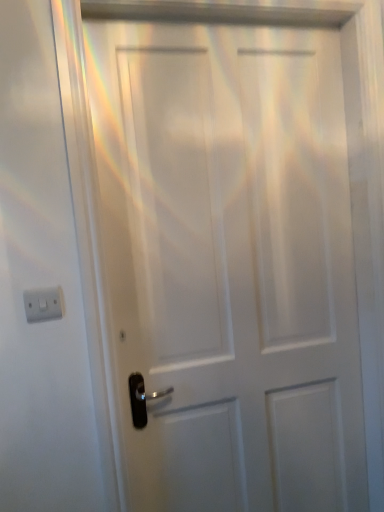
What do you see at coordinates (230, 264) in the screenshot? I see `white matte door at center` at bounding box center [230, 264].

In order to face white matte door at center, should I rotate leftwards or rightwards?

Rotate your view right by about 7.378°.

Measure the distance between point (292, 67) and camera.

Point (292, 67) is 4.41 feet from camera.

Locate an element on the screen. Image resolution: width=384 pixels, height=512 pixels. white matte door at center is located at coordinates (230, 264).

Where is `white plastic light switch at left`? The height and width of the screenshot is (512, 384). white plastic light switch at left is located at coordinates (43, 304).

Describe the element at coordinates (43, 304) in the screenshot. The width and height of the screenshot is (384, 512). I see `white plastic light switch at left` at that location.

In order to click on white matte door at center in this screenshot , I will do `click(230, 264)`.

Visually, is white matte door at center positioned to the left or to the right of white plastic light switch at left?

white matte door at center is to the right of white plastic light switch at left.

Is white matte door at center in front of white plastic light switch at left?

No, white matte door at center is further to the viewer.

Which is in front, point (135, 94) or point (48, 297)?

Positioned in front is point (48, 297).

From the image's perspective, would you say white matte door at center is shown under white plastic light switch at left?

Yes, from the image's perspective, white matte door at center is below white plastic light switch at left.

Based on the photo, from a real-world perspective, is white matte door at center over white plastic light switch at left?

No, from a real-world perspective, white matte door at center is not over white plastic light switch at left

Is white matte door at center wider than white plastic light switch at left?

Correct, the width of white matte door at center exceeds that of white plastic light switch at left.

Between white matte door at center and white plastic light switch at left, which one has more height?

white matte door at center.

Based on their sizes in the image, would you say white matte door at center is bigger or smaller than white plastic light switch at left?

Considering their sizes, white matte door at center takes up more space than white plastic light switch at left.

Is white matte door at center positioned beyond the bounds of white plastic light switch at left?

Absolutely, white matte door at center is external to white plastic light switch at left.

Is white matte door at center positioned far away from white plastic light switch at left?

They are positioned close to each other.

Is white matte door at center oriented towards white plastic light switch at left?

No, white matte door at center is not oriented towards white plastic light switch at left.

How distant is white matte door at center from white plastic light switch at left?

26.22 inches.

Image resolution: width=384 pixels, height=512 pixels. I want to click on door below the white plastic light switch at left (from a real-world perspective), so click(x=230, y=264).

Is white plastic light switch at left at the left side of white matte door at center?

Yes.

Does white plastic light switch at left lie behind white matte door at center?

That is False.

Which is behind, point (49, 298) or point (168, 161)?

The point (168, 161) is farther.

From the image's perspective, who appears lower, white plastic light switch at left or white matte door at center?

white matte door at center, from the image's perspective.

From a real-world perspective, does white plastic light switch at left sit lower than white matte door at center?

Incorrect, from a real-world perspective, white plastic light switch at left is higher than white matte door at center.

Considering the relative sizes of white plastic light switch at left and white matte door at center in the image provided, is white plastic light switch at left thinner than white matte door at center?

Yes.

Considering the sizes of objects white plastic light switch at left and white matte door at center in the image provided, who is taller, white plastic light switch at left or white matte door at center?

With more height is white matte door at center.

Consider the image. Looking at the image, does white plastic light switch at left seem bigger or smaller compared to white matte door at center?

In the image, white plastic light switch at left appears to be smaller than white matte door at center.

Is white matte door at center located within white plastic light switch at left?

No, white plastic light switch at left does not contain white matte door at center.

Is white plastic light switch at left far from white matte door at center?

No, white plastic light switch at left is not far from white matte door at center.

Is white plastic light switch at left facing away from white matte door at center?

No.

Can you tell me how much white plastic light switch at left and white matte door at center differ in facing direction?

They differ by 3.34 degrees in their facing directions.

Measure the distance from white plastic light switch at left to white matte door at center.

white plastic light switch at left is 66.61 centimeters away from white matte door at center.

At what (x,y) coordinates should I click in order to perform the action: click on light switch that appears above the white matte door at center (from a real-world perspective). Please return your answer as a coordinate pair (x, y). This screenshot has height=512, width=384. Looking at the image, I should click on (43, 304).

What are the coordinates of `door to the right of white plastic light switch at left` in the screenshot? It's located at (230, 264).

This screenshot has width=384, height=512. I want to click on light switch that is on the left side of white matte door at center, so click(43, 304).